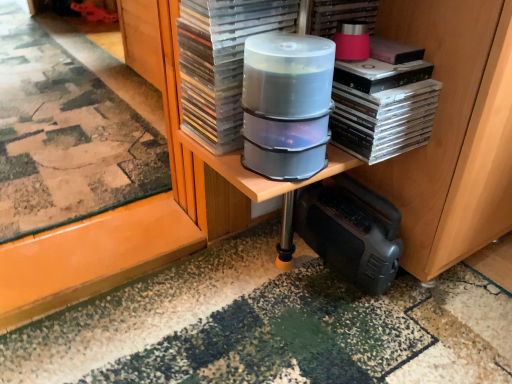
What do you see at coordinates (393, 51) in the screenshot?
I see `pink matte paperback book at upper right, the first paperback book when ordered from right to left` at bounding box center [393, 51].

Describe the element at coordinates (286, 105) in the screenshot. I see `clear plastic container at center, arranged as the 2th appliance when ordered from the bottom` at that location.

What is the approximate width of transparent plastic case at center, marked as the second paperback book in a right-to-left arrangement?

transparent plastic case at center, marked as the second paperback book in a right-to-left arrangement, is 6.65 inches in width.

Describe the element at coordinates (221, 63) in the screenshot. I see `transparent plastic case at center, marked as the second paperback book in a right-to-left arrangement` at that location.

This screenshot has height=384, width=512. I want to click on pink matte paperback book at upper right, the second paperback book when ordered from left to right, so click(x=393, y=51).

Do you think black plastic speaker at lower right, marked as the 1th appliance in a bottom-to-top arrangement, is within clear plastic container at center, arranged as the 2th appliance when ordered from the bottom, or outside of it?

black plastic speaker at lower right, marked as the 1th appliance in a bottom-to-top arrangement, is outside clear plastic container at center, arranged as the 2th appliance when ordered from the bottom.

Would you consider black plastic speaker at lower right, placed as the 2th appliance when sorted from top to bottom, to be distant from clear plastic container at center, arranged as the 2th appliance when ordered from the bottom?

black plastic speaker at lower right, placed as the 2th appliance when sorted from top to bottom, is actually quite close to clear plastic container at center, arranged as the 2th appliance when ordered from the bottom.

Consider the image. From the image's perspective, relative to clear plastic container at center, positioned as the first appliance in front-to-back order, is black plastic speaker at lower right, the 2th appliance from the front, above or below?

black plastic speaker at lower right, the 2th appliance from the front, is situated lower than clear plastic container at center, positioned as the first appliance in front-to-back order, in the image.

Considering the positions of points (338, 239) and (295, 115), is point (338, 239) farther from camera compared to point (295, 115)?

Yes, it is.

Can you confirm if pink matte paperback book at upper right, the first paperback book when ordered from right to left, is wider than black plastic speaker at lower right, placed as the 2th appliance when sorted from top to bottom?

Correct, the width of pink matte paperback book at upper right, the first paperback book when ordered from right to left, exceeds that of black plastic speaker at lower right, placed as the 2th appliance when sorted from top to bottom.

Considering the sizes of pink matte paperback book at upper right, the first paperback book when ordered from right to left, and black plastic speaker at lower right, the 2th appliance from the front, in the image, is pink matte paperback book at upper right, the first paperback book when ordered from right to left, bigger or smaller than black plastic speaker at lower right, the 2th appliance from the front,?

Considering their sizes, pink matte paperback book at upper right, the first paperback book when ordered from right to left, takes up less space than black plastic speaker at lower right, the 2th appliance from the front.

Would you say pink matte paperback book at upper right, the first paperback book when ordered from right to left, is to the left or to the right of black plastic speaker at lower right, marked as the 1th appliance in a bottom-to-top arrangement, in the picture?

Clearly, pink matte paperback book at upper right, the first paperback book when ordered from right to left, is on the right of black plastic speaker at lower right, marked as the 1th appliance in a bottom-to-top arrangement, in the image.

Is pink matte paperback book at upper right, the second paperback book when ordered from left to right, looking in the opposite direction of black plastic speaker at lower right, marked as the 1th appliance in a bottom-to-top arrangement?

pink matte paperback book at upper right, the second paperback book when ordered from left to right, does not have its back to black plastic speaker at lower right, marked as the 1th appliance in a bottom-to-top arrangement.

From a real-world perspective, between clear plastic container at center, marked as the 2th appliance in a back-to-front arrangement, and pink matte paperback book at upper right, the second paperback book when ordered from left to right, who is vertically higher?

pink matte paperback book at upper right, the second paperback book when ordered from left to right.

Is clear plastic container at center, arranged as the 2th appliance when ordered from the bottom, bigger or smaller than pink matte paperback book at upper right, the second paperback book when ordered from left to right?

In the image, clear plastic container at center, arranged as the 2th appliance when ordered from the bottom, appears to be larger than pink matte paperback book at upper right, the second paperback book when ordered from left to right.

Do you think clear plastic container at center, arranged as the 2th appliance when ordered from the bottom, is within pink matte paperback book at upper right, the first paperback book when ordered from right to left, or outside of it?

clear plastic container at center, arranged as the 2th appliance when ordered from the bottom, is located beyond the bounds of pink matte paperback book at upper right, the first paperback book when ordered from right to left.

Based on the photo, considering the sizes of black plastic speaker at lower right, placed as the 2th appliance when sorted from top to bottom, and transparent plastic case at center, which is the 1th paperback book in left-to-right order, in the image, is black plastic speaker at lower right, placed as the 2th appliance when sorted from top to bottom, wider or thinner than transparent plastic case at center, which is the 1th paperback book in left-to-right order,?

Considering their sizes, black plastic speaker at lower right, placed as the 2th appliance when sorted from top to bottom, looks slimmer than transparent plastic case at center, which is the 1th paperback book in left-to-right order.

Is black plastic speaker at lower right, marked as the 1th appliance in a bottom-to-top arrangement, with transparent plastic case at center, which is the 1th paperback book in left-to-right order?

No, black plastic speaker at lower right, marked as the 1th appliance in a bottom-to-top arrangement, is not with transparent plastic case at center, which is the 1th paperback book in left-to-right order.

Does black plastic speaker at lower right, marked as the 1th appliance in a bottom-to-top arrangement, turn towards transparent plastic case at center, which is the 1th paperback book in left-to-right order?

No, black plastic speaker at lower right, marked as the 1th appliance in a bottom-to-top arrangement, is not aimed at transparent plastic case at center, which is the 1th paperback book in left-to-right order.

Which is closer, (x=285, y=100) or (x=330, y=248)?

Point (x=285, y=100).

The height and width of the screenshot is (384, 512). In order to click on appliance lying behind the clear plastic container at center, positioned as the first appliance in front-to-back order in this screenshot , I will do `click(351, 231)`.

Could you tell me if clear plastic container at center, placed as the first appliance when sorted from top to bottom, is facing black plastic speaker at lower right, acting as the 1th appliance starting from the back?

No, clear plastic container at center, placed as the first appliance when sorted from top to bottom, is not facing towards black plastic speaker at lower right, acting as the 1th appliance starting from the back.

From a real-world perspective, which object stands above the other?

clear plastic container at center, placed as the first appliance when sorted from top to bottom.

Based on their positions, is transparent plastic case at center, which is the 1th paperback book in left-to-right order, located to the left or right of black plastic speaker at lower right, marked as the 1th appliance in a bottom-to-top arrangement?

From the image, it's evident that transparent plastic case at center, which is the 1th paperback book in left-to-right order, is to the left of black plastic speaker at lower right, marked as the 1th appliance in a bottom-to-top arrangement.

From a real-world perspective, is transparent plastic case at center, marked as the second paperback book in a right-to-left arrangement, physically located above or below black plastic speaker at lower right, the 2th appliance from the front?

transparent plastic case at center, marked as the second paperback book in a right-to-left arrangement, is above black plastic speaker at lower right, the 2th appliance from the front.

Is transparent plastic case at center, which is the 1th paperback book in left-to-right order, looking in the opposite direction of black plastic speaker at lower right, acting as the 1th appliance starting from the back?

No, transparent plastic case at center, which is the 1th paperback book in left-to-right order,'s orientation is not away from black plastic speaker at lower right, acting as the 1th appliance starting from the back.

You are a GUI agent. You are given a task and a screenshot of the screen. Output one action in this format:
    pyautogui.click(x=<x>, y=<y>)
    Task: Click on the paperback book on the left of black plastic speaker at lower right, marked as the 1th appliance in a bottom-to-top arrangement
    
    Given the screenshot: What is the action you would take?
    pyautogui.click(x=221, y=63)

Is clear plastic container at center, placed as the first appliance when sorted from top to bottom, completely or partially outside of transparent plastic case at center, marked as the second paperback book in a right-to-left arrangement?

Yes.

Does point (333, 46) appear closer or farther from the camera than point (203, 71)?

Point (333, 46) appears to be closer to the viewer than point (203, 71).

How many degrees apart are the facing directions of clear plastic container at center, positioned as the first appliance in front-to-back order, and transparent plastic case at center, which is the 1th paperback book in left-to-right order?

They differ by 0.568 degrees in their facing directions.

Is clear plastic container at center, positioned as the first appliance in front-to-back order, closer to the viewer compared to transparent plastic case at center, which is the 1th paperback book in left-to-right order?

Yes, clear plastic container at center, positioned as the first appliance in front-to-back order, is closer to the camera.

Locate an element on the screen. The width and height of the screenshot is (512, 384). appliance behind the clear plastic container at center, placed as the first appliance when sorted from top to bottom is located at coordinates (351, 231).

From the image's perspective, starting from the pink matte paperback book at upper right, the second paperback book when ordered from left to right, which appliance is the 2nd one below? Please provide its 2D coordinates.

[(351, 231)]

Considering their positions, is clear plastic cd cases at center positioned further to black plastic speaker at lower right, marked as the 1th appliance in a bottom-to-top arrangement, than pink matte paperback book at upper right, the second paperback book when ordered from left to right?

pink matte paperback book at upper right, the second paperback book when ordered from left to right, is positioned further to the anchor black plastic speaker at lower right, marked as the 1th appliance in a bottom-to-top arrangement.

Which object lies nearer to the anchor point pink matte paperback book at upper right, the second paperback book when ordered from left to right, transparent plastic case at center, marked as the second paperback book in a right-to-left arrangement, or clear plastic cd cases at center?

clear plastic cd cases at center.

Looking at the image, which one is located closer to clear plastic container at center, positioned as the first appliance in front-to-back order, black plastic speaker at lower right, placed as the 2th appliance when sorted from top to bottom, or pink matte paperback book at upper right, the first paperback book when ordered from right to left?

Among the two, pink matte paperback book at upper right, the first paperback book when ordered from right to left, is located nearer to clear plastic container at center, positioned as the first appliance in front-to-back order.

When comparing their distances from black plastic speaker at lower right, the 2th appliance from the front, does pink matte paperback book at upper right, the second paperback book when ordered from left to right, or transparent plastic case at center, which is the 1th paperback book in left-to-right order, seem closer?

Among the two, pink matte paperback book at upper right, the second paperback book when ordered from left to right, is located nearer to black plastic speaker at lower right, the 2th appliance from the front.

Based on their spatial positions, is clear plastic container at center, positioned as the first appliance in front-to-back order, or pink matte paperback book at upper right, the first paperback book when ordered from right to left, closer to clear plastic cd cases at center?

Among the two, pink matte paperback book at upper right, the first paperback book when ordered from right to left, is located nearer to clear plastic cd cases at center.

From the picture: When comparing their distances from pink matte paperback book at upper right, the first paperback book when ordered from right to left, does clear plastic cd cases at center or clear plastic container at center, marked as the 2th appliance in a back-to-front arrangement, seem closer?

clear plastic cd cases at center is closer to pink matte paperback book at upper right, the first paperback book when ordered from right to left.

Estimate the real-world distances between objects in this image. Which object is further from clear plastic container at center, marked as the 2th appliance in a back-to-front arrangement, pink matte paperback book at upper right, the second paperback book when ordered from left to right, or transparent plastic case at center, which is the 1th paperback book in left-to-right order?

The object further to clear plastic container at center, marked as the 2th appliance in a back-to-front arrangement, is pink matte paperback book at upper right, the second paperback book when ordered from left to right.

When comparing their distances from pink matte paperback book at upper right, the first paperback book when ordered from right to left, does transparent plastic case at center, which is the 1th paperback book in left-to-right order, or clear plastic container at center, placed as the first appliance when sorted from top to bottom, seem closer?

The object closer to pink matte paperback book at upper right, the first paperback book when ordered from right to left, is clear plastic container at center, placed as the first appliance when sorted from top to bottom.

The image size is (512, 384). I want to click on appliance between clear plastic cd cases at center and black plastic speaker at lower right, marked as the 1th appliance in a bottom-to-top arrangement, in the up-down direction, so click(286, 105).

At what (x,y) coordinates should I click in order to perform the action: click on book between transparent plastic case at center, marked as the second paperback book in a right-to-left arrangement, and pink matte paperback book at upper right, the second paperback book when ordered from left to right, in the horizontal direction. Please return your answer as a coordinate pair (x, y). This screenshot has width=512, height=384. Looking at the image, I should click on (383, 102).

Find the location of a particular element. This screenshot has height=384, width=512. appliance between transparent plastic case at center, marked as the second paperback book in a right-to-left arrangement, and clear plastic cd cases at center from left to right is located at coordinates (286, 105).

The width and height of the screenshot is (512, 384). I want to click on book between clear plastic container at center, arranged as the 2th appliance when ordered from the bottom, and pink matte paperback book at upper right, the first paperback book when ordered from right to left, in the horizontal direction, so click(x=383, y=102).